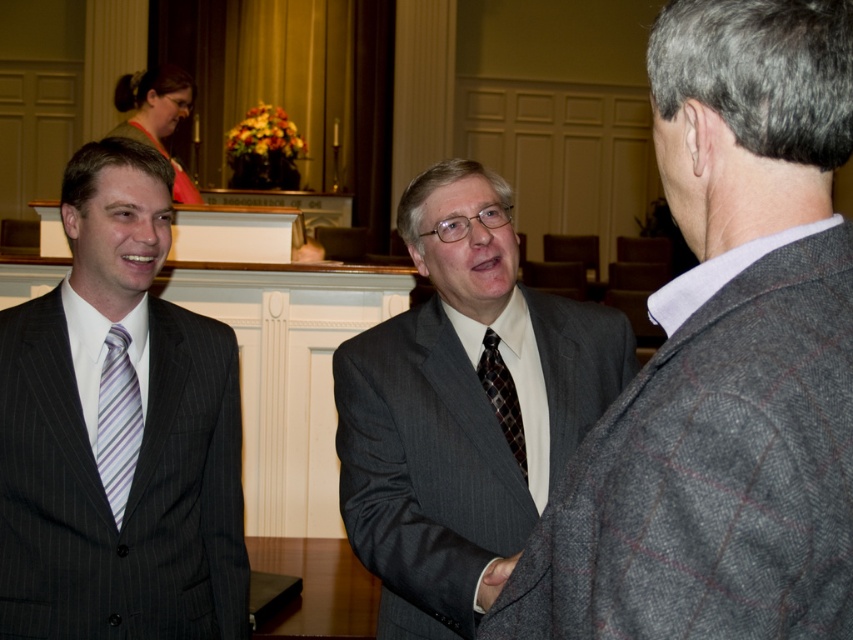
You are organizing a photo shoot and need to ensure that the gray textured blazer at center and the striped silk tie at left are both visible in the frame. Based on their sizes, which one is more likely to occupy more space in the image?

The gray textured blazer at center is wider than the striped silk tie at left, so it occupies more space in the image.

You are organizing a charity event and need to seat guests based on their clothing. You have two guests wearing the gray textured blazer at center and the gray pinstripe suit at center. Which guest should you seat closer to the front if the seating arrangement requires shorter attire to be seated closer to the stage?

The gray textured blazer at center is shorter than the gray pinstripe suit at center, so the guest wearing the gray textured blazer at center should be seated closer to the front.